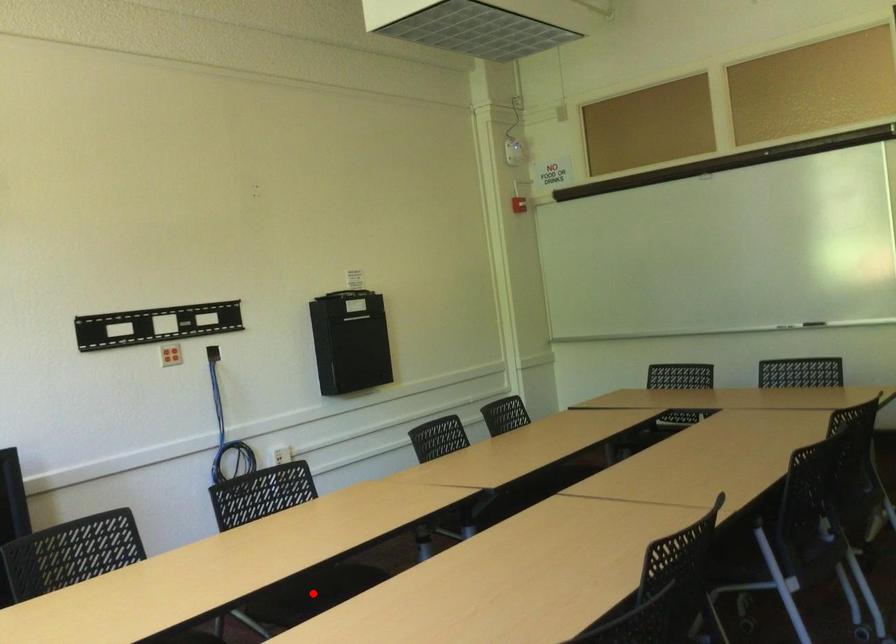
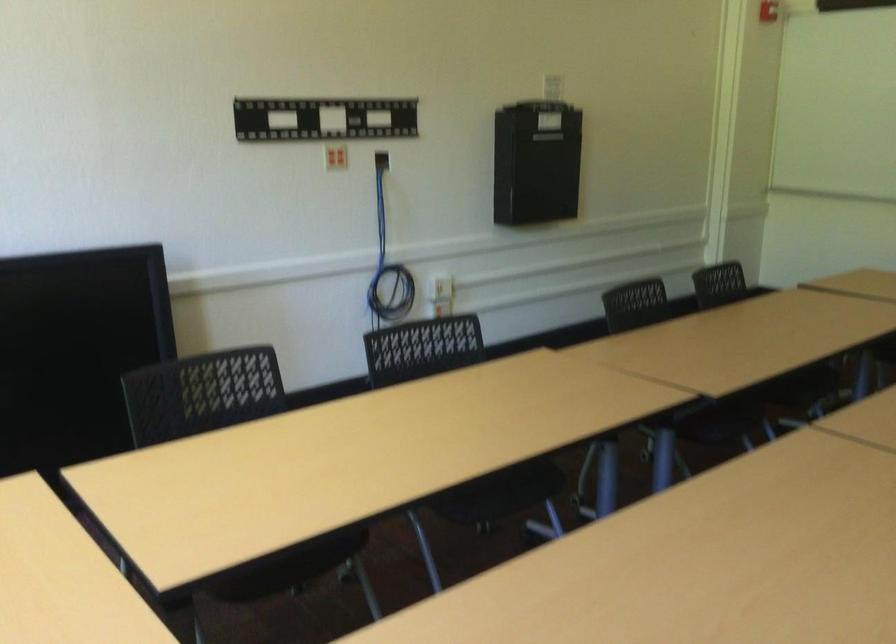
Question: I am providing you with two images of the same scene from different viewpoints. A red point is marked on the first image. At the location where the point appears in image 1, is it still visible in image 2?

Choices:
 (A) Yes
 (B) No

Answer: (B)